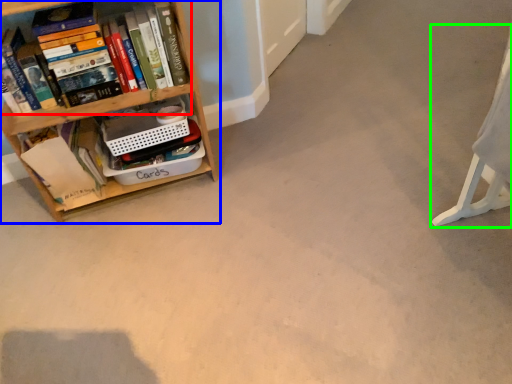
Question: Which is farther away from book (highlighted by a red box)? shelf (highlighted by a blue box) or swivel chair (highlighted by a green box)?

Choices:
 (A) shelf
 (B) swivel chair

Answer: (B)